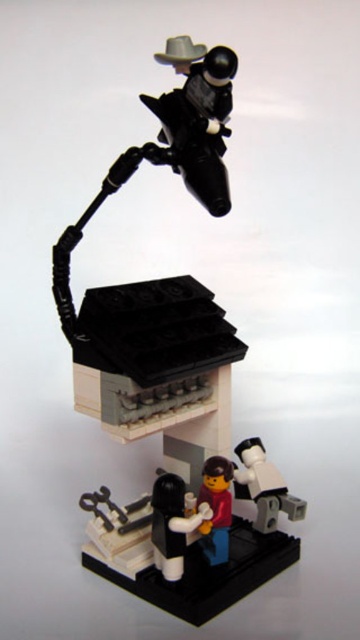
Question: Which object appears farthest from the camera in this image?

Choices:
 (A) black plastic microphone at upper center
 (B) smooth plastic cup at lower center

Answer: (B)

Question: Is black plastic microphone at upper center to the left of matte black coffee cup at lower center from the viewer's perspective?

Choices:
 (A) no
 (B) yes

Answer: (A)

Question: Can you confirm if matte black coffee cup at lower center is positioned below smooth plastic cup at lower center?

Choices:
 (A) yes
 (B) no

Answer: (A)

Question: Based on their relative distances, which object is nearer to the smooth plastic cup at lower center?

Choices:
 (A) black plastic microphone at upper center
 (B) matte black coffee cup at lower center

Answer: (B)

Question: Which is farther from the matte black coffee cup at lower center?

Choices:
 (A) smooth plastic cup at lower center
 (B) black plastic microphone at upper center

Answer: (B)

Question: Does black plastic microphone at upper center appear under matte black coffee cup at lower center?

Choices:
 (A) yes
 (B) no

Answer: (B)